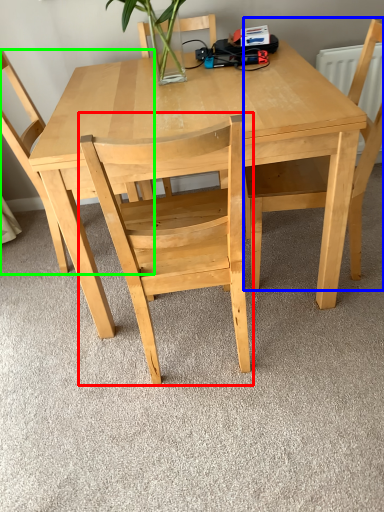
Question: Which is farther away from chair (highlighted by a red box)? chair (highlighted by a blue box) or chair (highlighted by a green box)?

Choices:
 (A) chair
 (B) chair

Answer: (B)